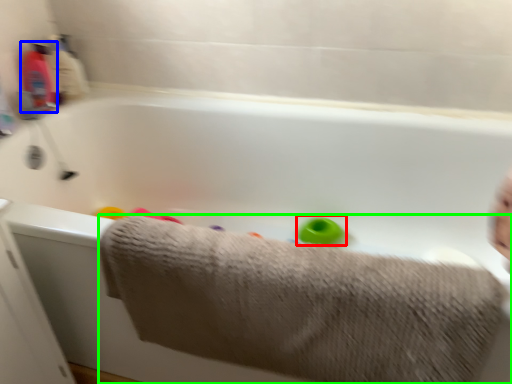
Question: Considering the real-world distances, which object is farthest from toy (highlighted by a red box)? baby bottle (highlighted by a blue box) or towel (highlighted by a green box)?

Choices:
 (A) baby bottle
 (B) towel

Answer: (A)